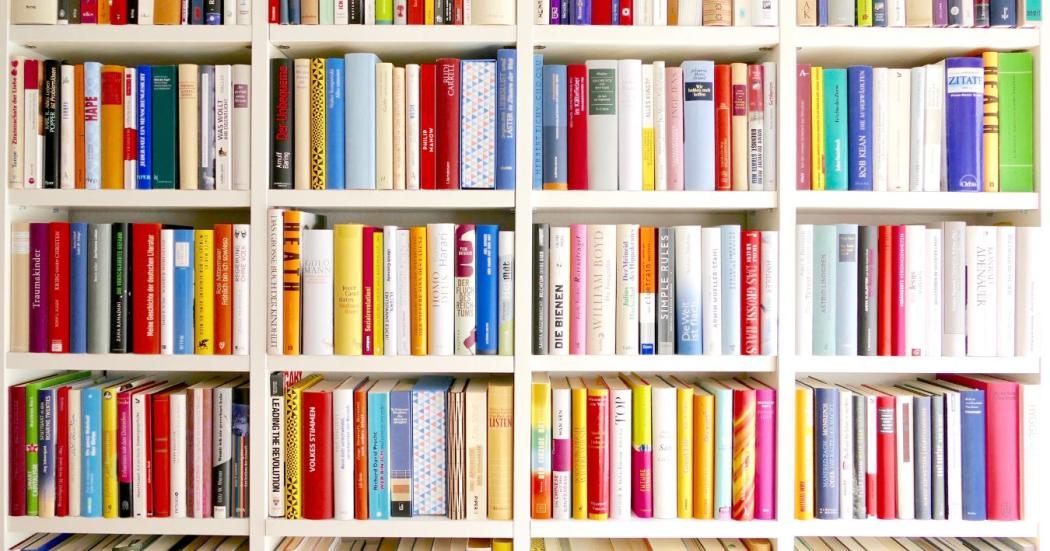
Find the location of a particular element. 4th shelve is located at coordinates (93, 526), (420, 526), (647, 527), (889, 529).